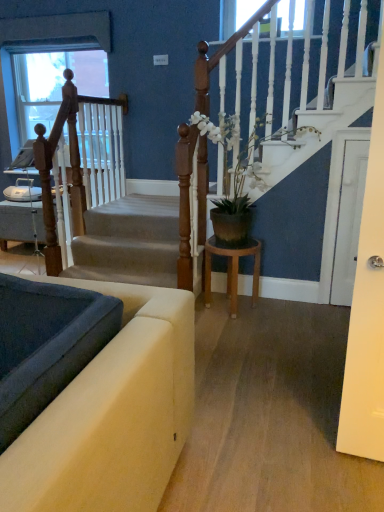
At what (x,y) coordinates should I click in order to perform the action: click on unoccupied region to the right of wooden stool at center. Please return your answer as a coordinate pair (x, y). The height and width of the screenshot is (512, 384). Looking at the image, I should click on (279, 313).